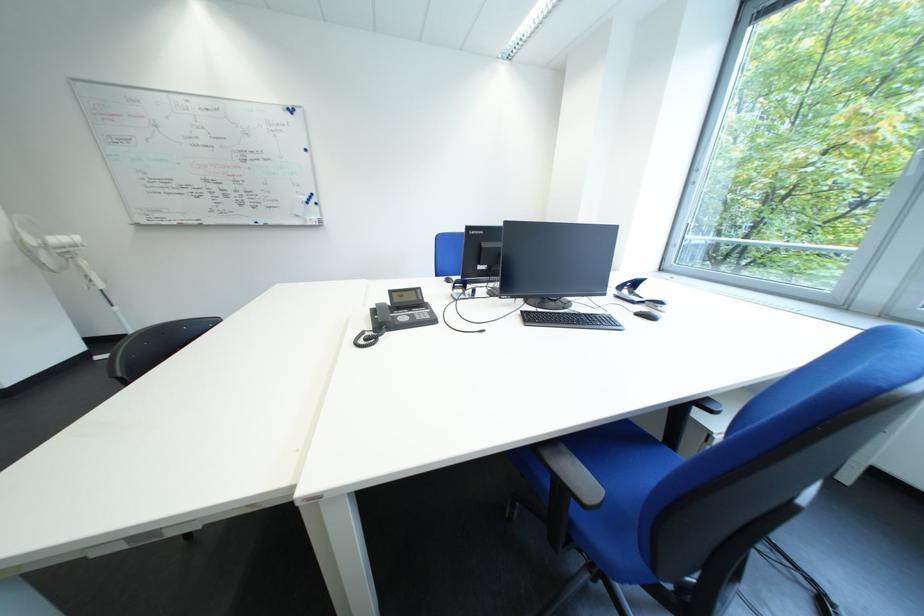
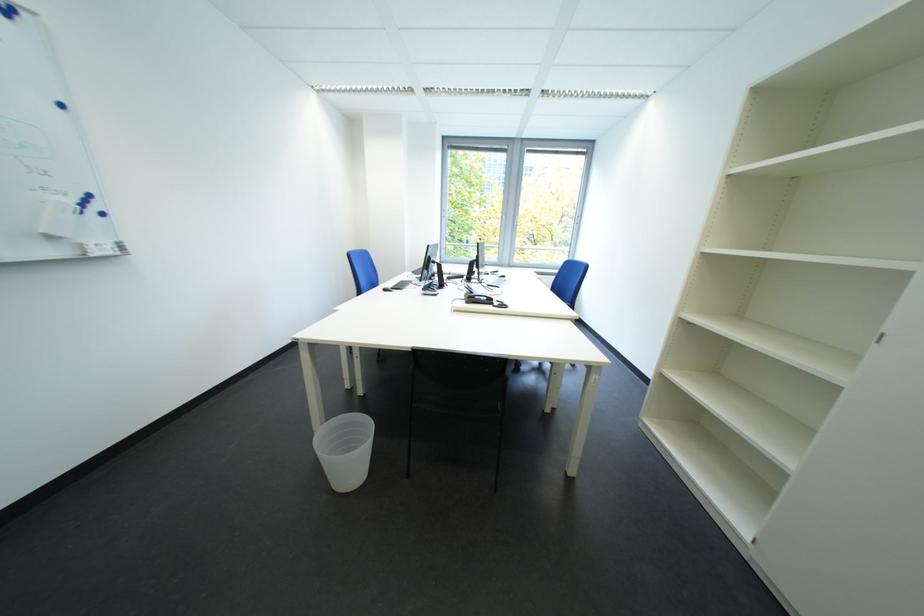
Locate, in the second image, the point that corresponds to point (304, 113) in the first image.

(17, 12)